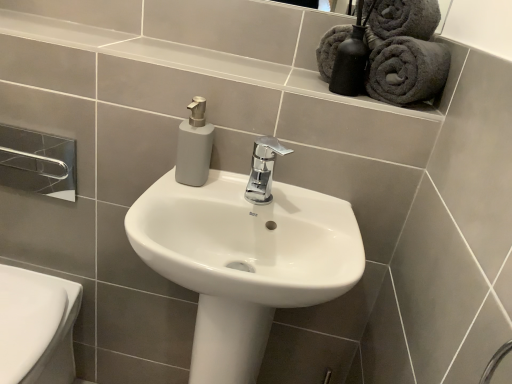
Question: Does dark grey plush bath towel at upper right, the 2th bath towel when ordered from right to left, turn towards gray matte tile at lower right?

Choices:
 (A) yes
 (B) no

Answer: (B)

Question: Is dark grey plush bath towel at upper right, the 2th bath towel positioned from the left, to the right of gray matte tile at lower right from the viewer's perspective?

Choices:
 (A) yes
 (B) no

Answer: (A)

Question: Considering the relative sizes of dark grey plush bath towel at upper right, the 2th bath towel positioned from the left, and gray matte tile at lower right in the image provided, is dark grey plush bath towel at upper right, the 2th bath towel positioned from the left, wider than gray matte tile at lower right?

Choices:
 (A) no
 (B) yes

Answer: (B)

Question: Is gray matte tile at lower right surrounded by dark grey plush bath towel at upper right, the 2th bath towel when ordered from right to left?

Choices:
 (A) no
 (B) yes

Answer: (A)

Question: Does dark grey plush bath towel at upper right, the 2th bath towel positioned from the left, have a lesser width compared to gray matte tile at lower right?

Choices:
 (A) yes
 (B) no

Answer: (B)

Question: From their relative heights in the image, would you say white glossy sink at center is taller or shorter than dark grey plush bath towel at upper right, the 2th bath towel when ordered from right to left?

Choices:
 (A) short
 (B) tall

Answer: (B)

Question: In the image, is white glossy sink at center positioned in front of or behind dark grey plush bath towel at upper right, the 2th bath towel positioned from the left?

Choices:
 (A) behind
 (B) front

Answer: (B)

Question: Does point (195, 190) appear closer or farther from the camera than point (384, 52)?

Choices:
 (A) farther
 (B) closer

Answer: (A)

Question: From the image's perspective, is white glossy sink at center above or below dark grey plush bath towel at upper right, the 2th bath towel positioned from the left?

Choices:
 (A) below
 (B) above

Answer: (A)

Question: Is white glossy bidet at lower left bigger or smaller than chrome metallic towel bar at upper left?

Choices:
 (A) small
 (B) big

Answer: (B)

Question: Is point (17, 301) positioned closer to the camera than point (24, 139)?

Choices:
 (A) closer
 (B) farther

Answer: (B)

Question: Do you think white glossy bidet at lower left is within chrome metallic towel bar at upper left, or outside of it?

Choices:
 (A) outside
 (B) inside

Answer: (A)

Question: In terms of width, does white glossy bidet at lower left look wider or thinner when compared to chrome metallic towel bar at upper left?

Choices:
 (A) thin
 (B) wide

Answer: (B)

Question: Is dark gray plush towel at upper right, which ranks as the 1th bath towel in right-to-left order, to the left or to the right of chrome metallic towel bar at upper left in the image?

Choices:
 (A) right
 (B) left

Answer: (A)

Question: From a real-world perspective, is dark gray plush towel at upper right, which is counted as the third bath towel, starting from the left, above or below chrome metallic towel bar at upper left?

Choices:
 (A) below
 (B) above

Answer: (B)